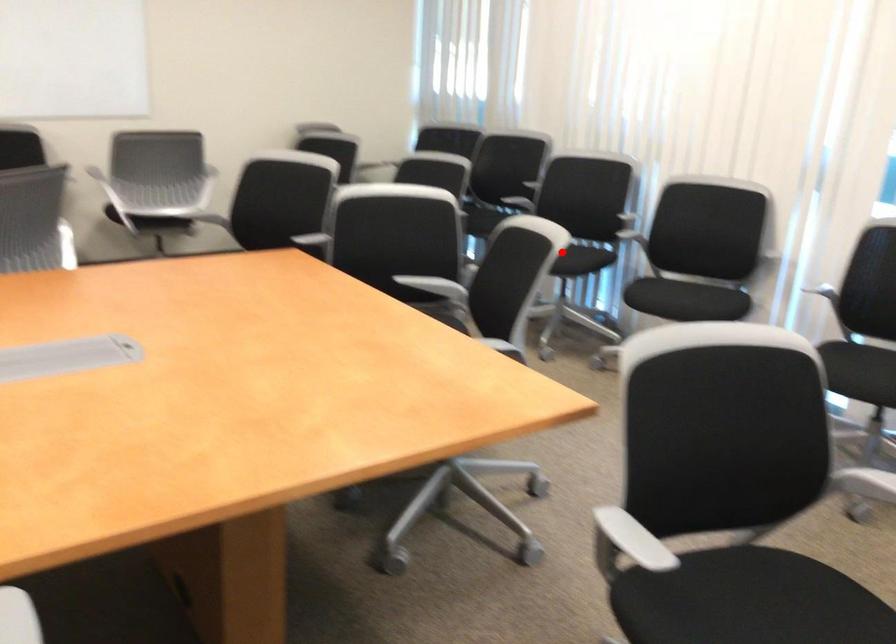
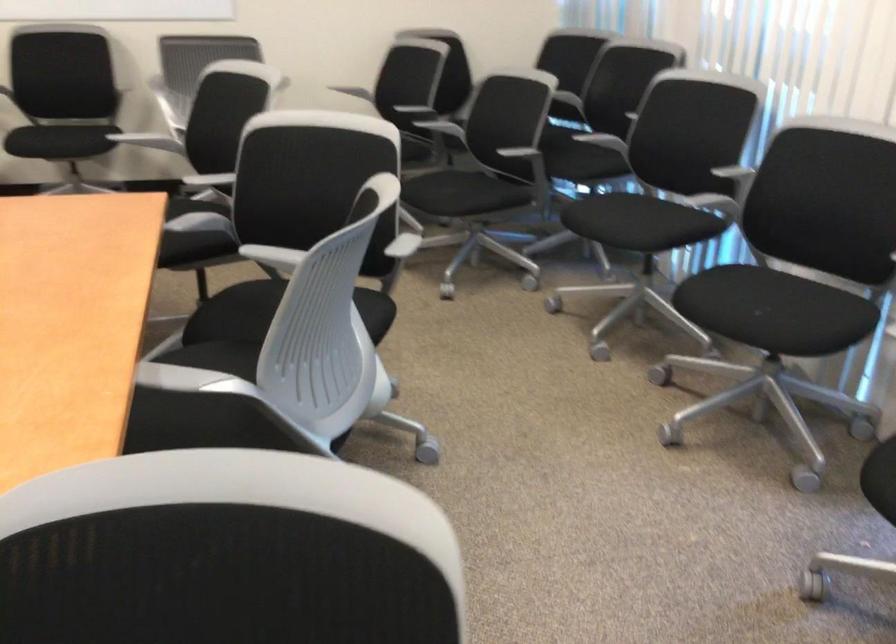
Find the pixel in the second image that matches the highlighted location in the first image.

(624, 221)